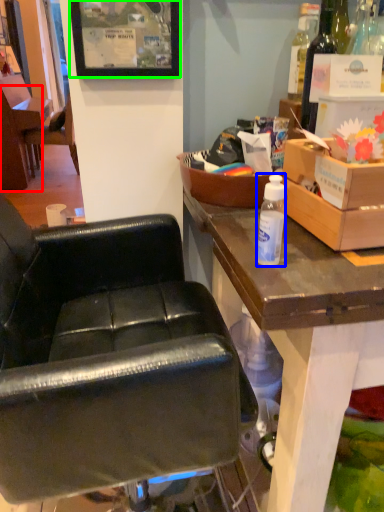
Question: Considering the real-world distances, which object is farthest from chair (highlighted by a red box)? bottle (highlighted by a blue box) or picture frame (highlighted by a green box)?

Choices:
 (A) bottle
 (B) picture frame

Answer: (A)